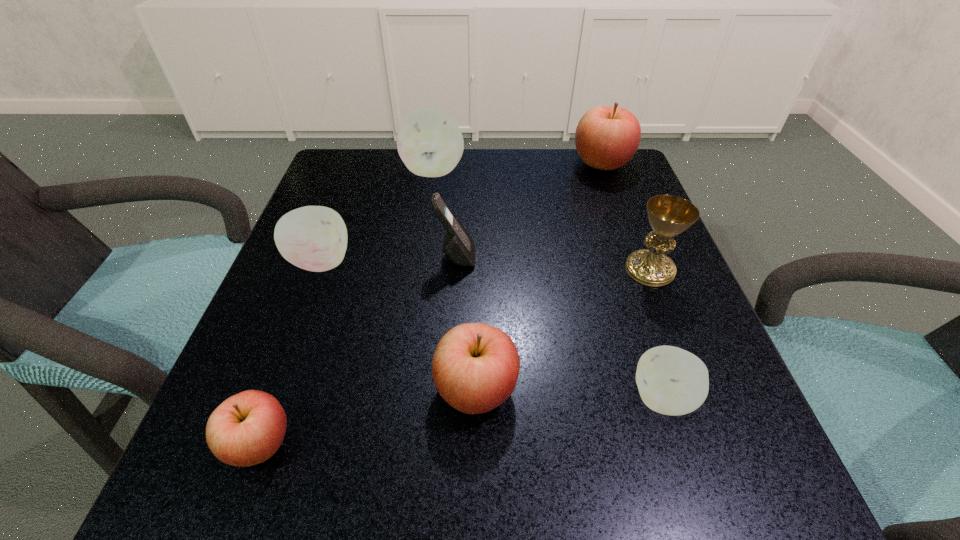
The height and width of the screenshot is (540, 960). In order to click on the smallest white apple in this screenshot , I will do `click(672, 381)`.

Where is `the leftmost red apple`? the leftmost red apple is located at coordinates (246, 429).

You are a GUI agent. You are given a task and a screenshot of the screen. Output one action in this format:
    pyautogui.click(x=<x>, y=<y>)
    Task: Click on the free space located on the front of the biggest white apple
    This screenshot has height=540, width=960.
    Given the screenshot: What is the action you would take?
    pyautogui.click(x=425, y=232)

At what (x,y) coordinates should I click in order to perform the action: click on free space located on the front of the farthest red apple. Please return your answer as a coordinate pair (x, y). This screenshot has height=540, width=960. Looking at the image, I should click on (615, 201).

Where is `vacant space located 0.350m on the left of the chalice`? vacant space located 0.350m on the left of the chalice is located at coordinates (435, 269).

Find the location of a particular element. The height and width of the screenshot is (540, 960). free spot located 0.210m on the front-facing side of the cellular telephone is located at coordinates (587, 256).

You are a GUI agent. You are given a task and a screenshot of the screen. Output one action in this format:
    pyautogui.click(x=<x>, y=<y>)
    Task: Click on the free spot located on the right of the fourth nearest apple
    This screenshot has width=960, height=540.
    Given the screenshot: What is the action you would take?
    pyautogui.click(x=555, y=262)

This screenshot has height=540, width=960. Find the location of `vacant space positioned on the back of the second smallest red apple`. vacant space positioned on the back of the second smallest red apple is located at coordinates (477, 280).

I want to click on vacant region located on the back of the rightmost white apple, so click(609, 231).

The height and width of the screenshot is (540, 960). In order to click on blank space located 0.350m on the right of the leftmost red apple in this screenshot , I will do [x=561, y=443].